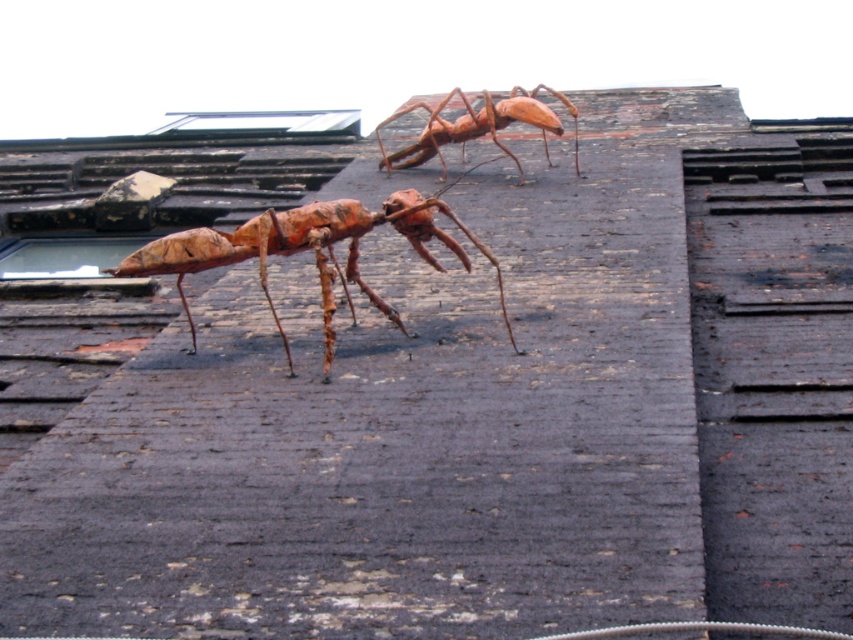
You are standing on a weathered rooftop with two metallic ant sculptures. You need to place a new rustic wood insect at center. Where should you place it?

You should place the rustic wood insect at center at point (306, 248).